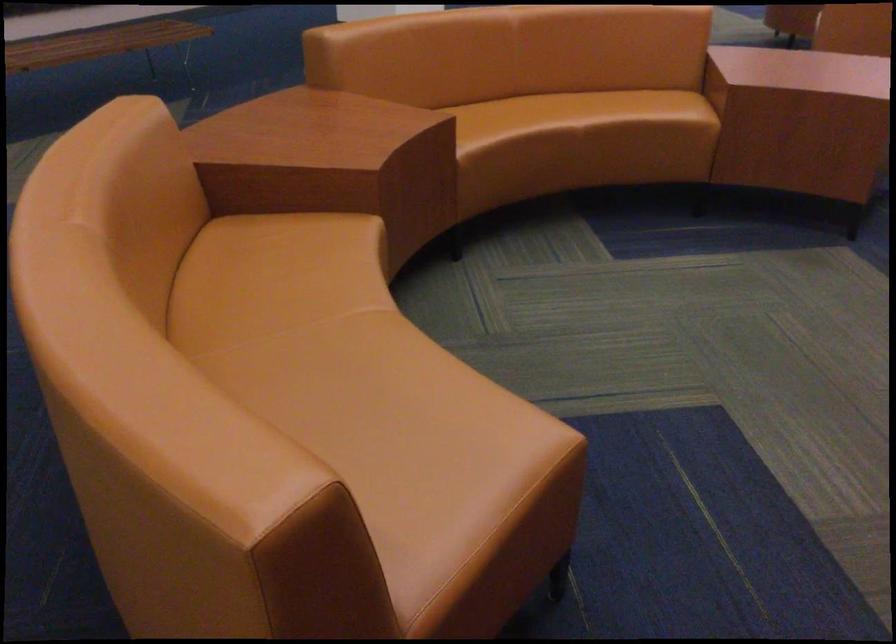
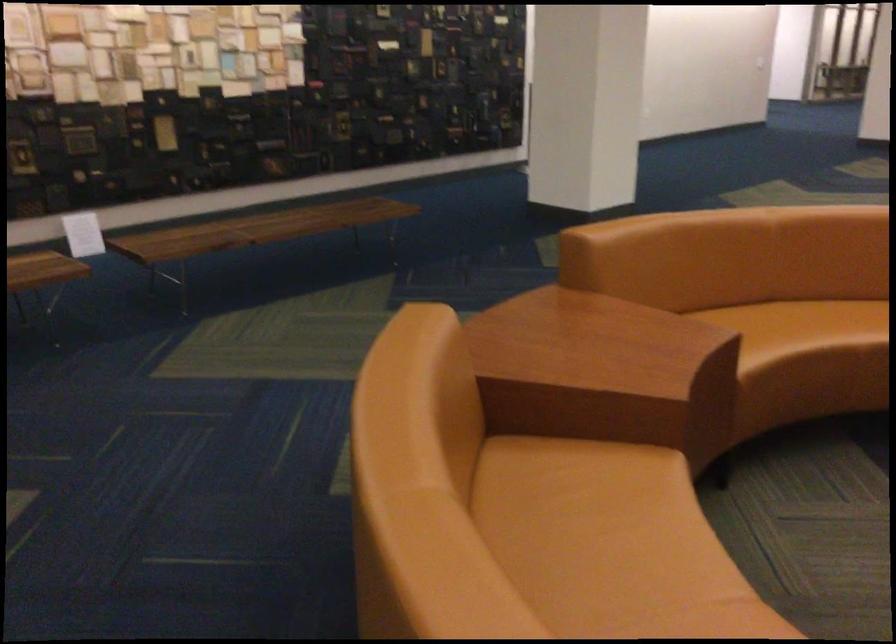
Question: The images are taken continuously from a first-person perspective. In which direction is your viewpoint rotating?

Choices:
 (A) Left
 (B) Right
 (C) Up
 (D) Down

Answer: (C)